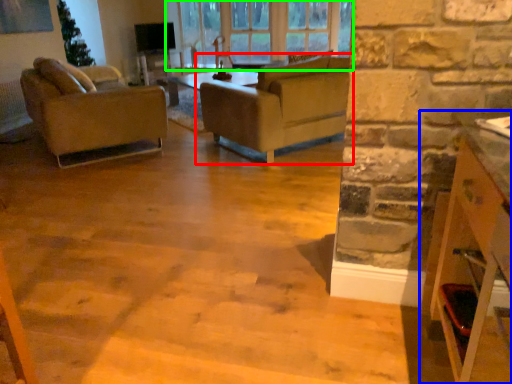
Question: Which is nearer to the studio couch (highlighted by a red box)? cabinetry (highlighted by a blue box) or window (highlighted by a green box).

Choices:
 (A) cabinetry
 (B) window

Answer: (B)